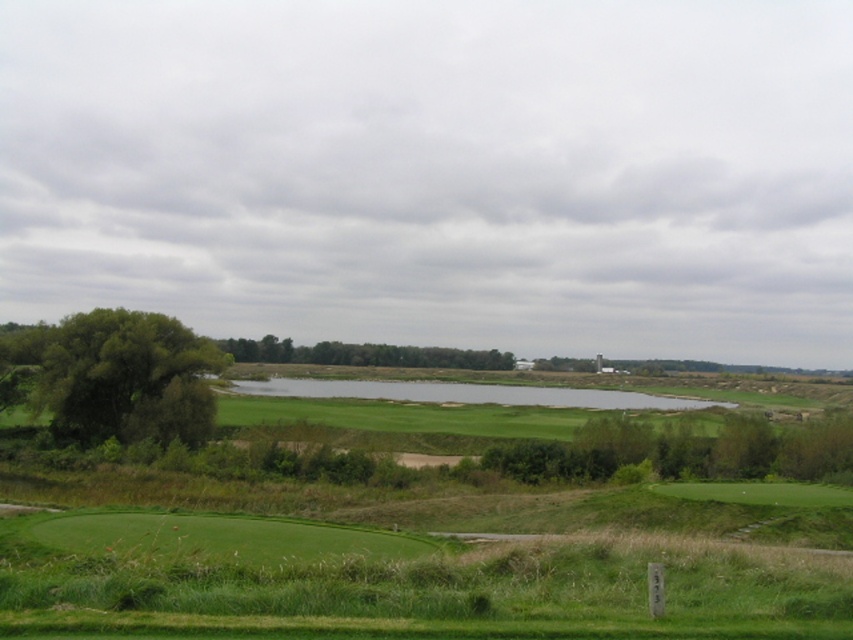
Question: Does clear water at center appear on the left side of green leafy trees at center?

Choices:
 (A) no
 (B) yes

Answer: (A)

Question: Which object is positioned farthest from the green leafy trees at center?

Choices:
 (A) green leafy tree at left
 (B) clear water at center

Answer: (A)

Question: Can you confirm if green leafy tree at left is thinner than green leafy trees at center?

Choices:
 (A) no
 (B) yes

Answer: (B)

Question: Which point appears closest to the camera in this image?

Choices:
 (A) (96, 371)
 (B) (495, 362)

Answer: (A)

Question: Which object appears closest to the camera in this image?

Choices:
 (A) clear water at center
 (B) green leafy tree at left
 (C) green leafy trees at center

Answer: (B)

Question: Does green leafy tree at left have a greater width compared to clear water at center?

Choices:
 (A) no
 (B) yes

Answer: (A)